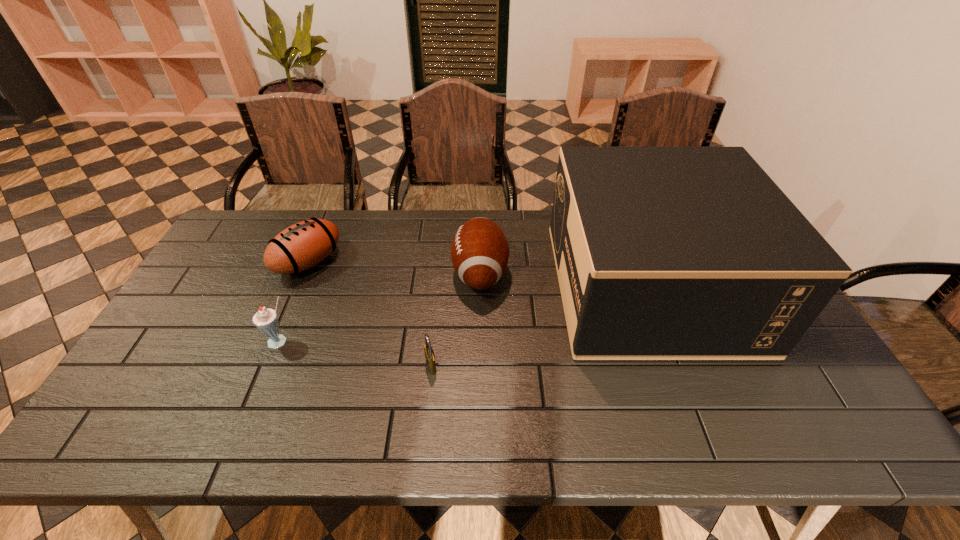
Where is `box`? The width and height of the screenshot is (960, 540). box is located at coordinates (662, 253).

The height and width of the screenshot is (540, 960). I want to click on the tallest object, so click(662, 253).

Find the location of `the second object from right to left`. the second object from right to left is located at coordinates (479, 252).

Find the location of a particular element. The image size is (960, 540). the right football (American) is located at coordinates (479, 252).

You are a GUI agent. You are given a task and a screenshot of the screen. Output one action in this format:
    pyautogui.click(x=<x>, y=<y>)
    Task: Click on the milkshake
    The height and width of the screenshot is (540, 960).
    Given the screenshot: What is the action you would take?
    pyautogui.click(x=266, y=320)

Image resolution: width=960 pixels, height=540 pixels. What are the coordinates of `the fourth tallest object` in the screenshot? It's located at tap(303, 245).

Locate an element on the screen. the left football (American) is located at coordinates (303, 245).

What are the coordinates of `padlock` in the screenshot? It's located at (429, 354).

Image resolution: width=960 pixels, height=540 pixels. I want to click on the third object from left to right, so click(429, 354).

Image resolution: width=960 pixels, height=540 pixels. What are the coordinates of `free space located on the front-facing side of the box` in the screenshot? It's located at (438, 286).